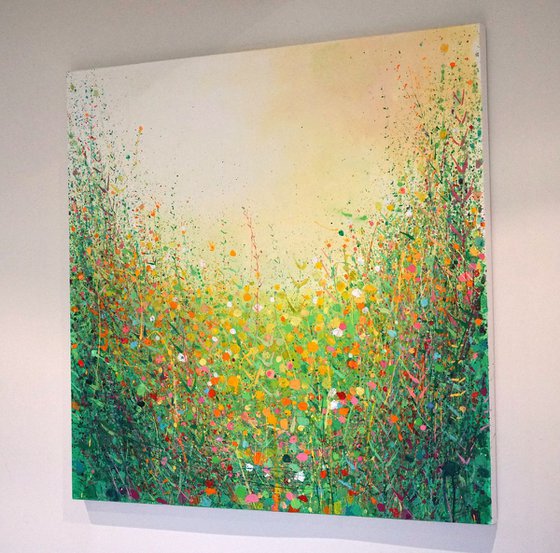
What are the coordinates of `painting` in the screenshot? It's located at (265, 212).